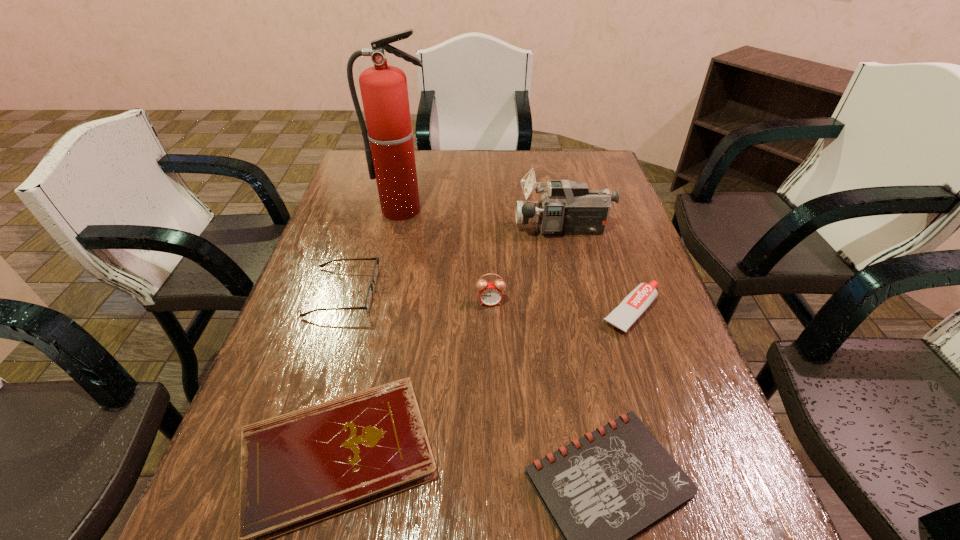
Where is `vacant area located on the clock face of the third tallest object`? vacant area located on the clock face of the third tallest object is located at coordinates (492, 354).

The image size is (960, 540). Find the location of `free space located 0.210m on the front-facing side of the spectacles`. free space located 0.210m on the front-facing side of the spectacles is located at coordinates (459, 292).

This screenshot has width=960, height=540. I want to click on vacant space positioned on the left of the toothpaste, so click(439, 311).

Find the location of `fire extinguisher that is at the left edge`. fire extinguisher that is at the left edge is located at coordinates (390, 156).

At what (x,y) coordinates should I click in order to perform the action: click on spectacles that is at the left edge. Please return your answer as a coordinate pair (x, y). Looking at the image, I should click on (369, 296).

Identify the location of camcorder located in the right edge section of the desktop. This screenshot has width=960, height=540. (568, 207).

Where is `toothpaste that is at the right edge`? Image resolution: width=960 pixels, height=540 pixels. toothpaste that is at the right edge is located at coordinates (635, 303).

This screenshot has width=960, height=540. In the image, there is a desktop. In order to click on vacant space at the far edge in this screenshot , I will do `click(551, 178)`.

At what (x,y) coordinates should I click in order to perform the action: click on vacant space at the left edge of the desktop. Please return your answer as a coordinate pair (x, y). Image resolution: width=960 pixels, height=540 pixels. Looking at the image, I should click on (340, 313).

Identify the location of free point at the right edge. This screenshot has width=960, height=540. 693,402.